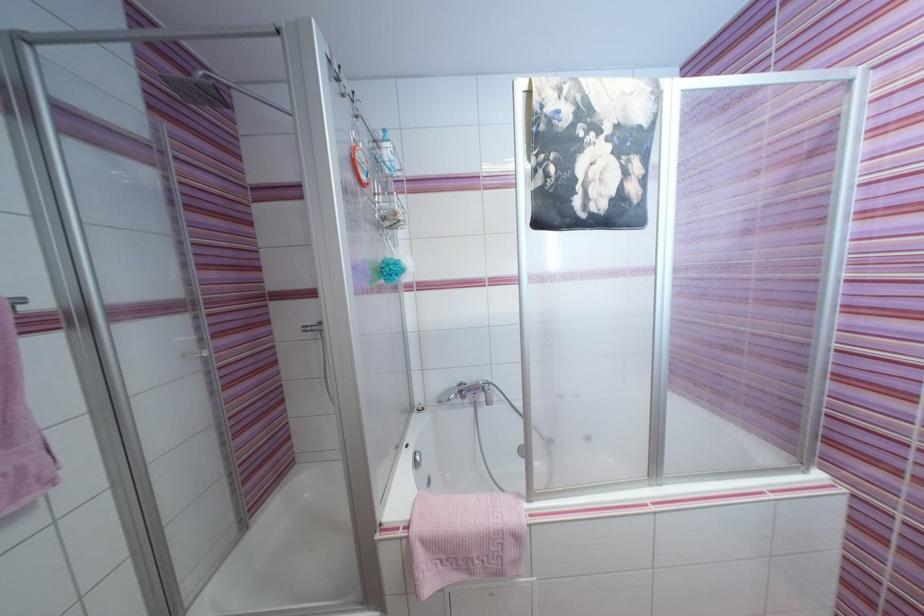
Identify the location of silver drain knob. The image size is (924, 616). (417, 459).